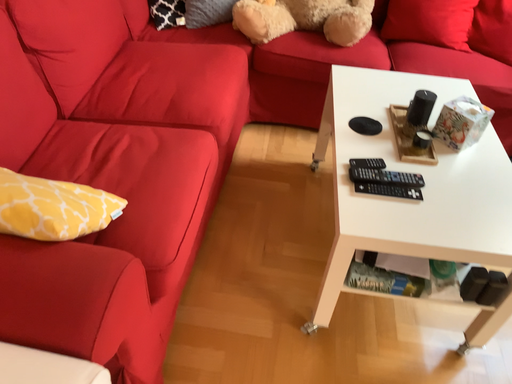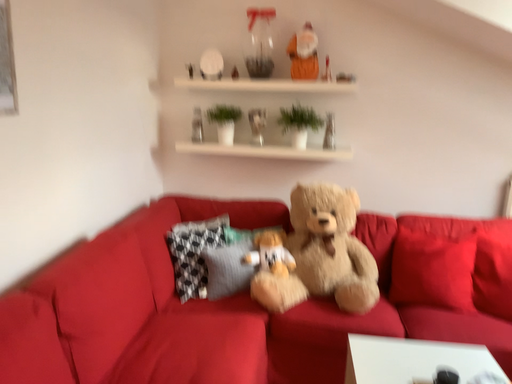
Question: How did the camera likely rotate when shooting the video?

Choices:
 (A) rotated upward
 (B) rotated downward

Answer: (A)